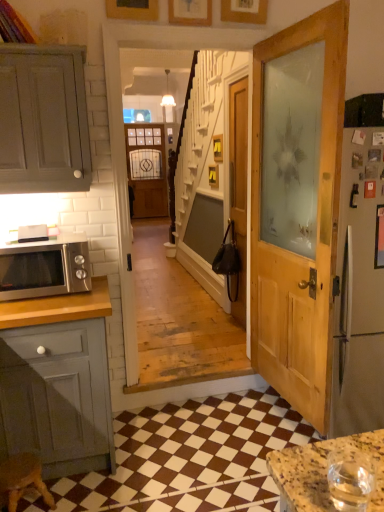
At what (x,y) coordinates should I click in order to perform the action: click on unoccupied region to the right of brown wooden stool at lower left. Please return your answer as a coordinate pair (x, y). The image size is (384, 512). Looking at the image, I should click on [x=87, y=493].